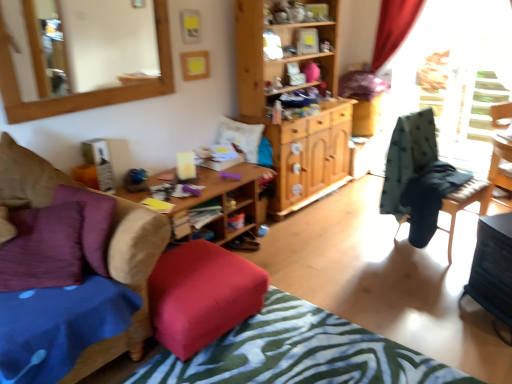
At what (x,y) coordinates should I click in order to perform the action: click on free space to the left of wooden chair at right, acting as the 2th chair starting from the left. Please return your answer as a coordinate pair (x, y). This screenshot has width=512, height=384. Looking at the image, I should click on (367, 246).